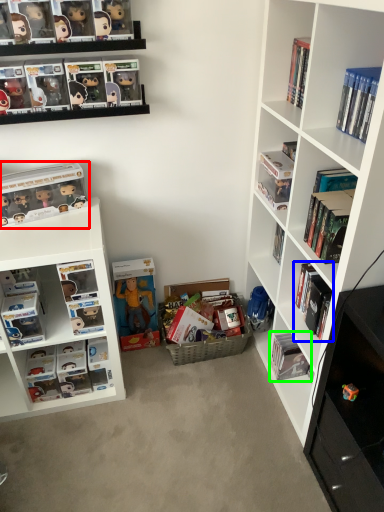
Question: Which object is the closest to the book (highlighted by a red box)? Choose among these: book (highlighted by a blue box) or book (highlighted by a green box).

Choices:
 (A) book
 (B) book

Answer: (A)